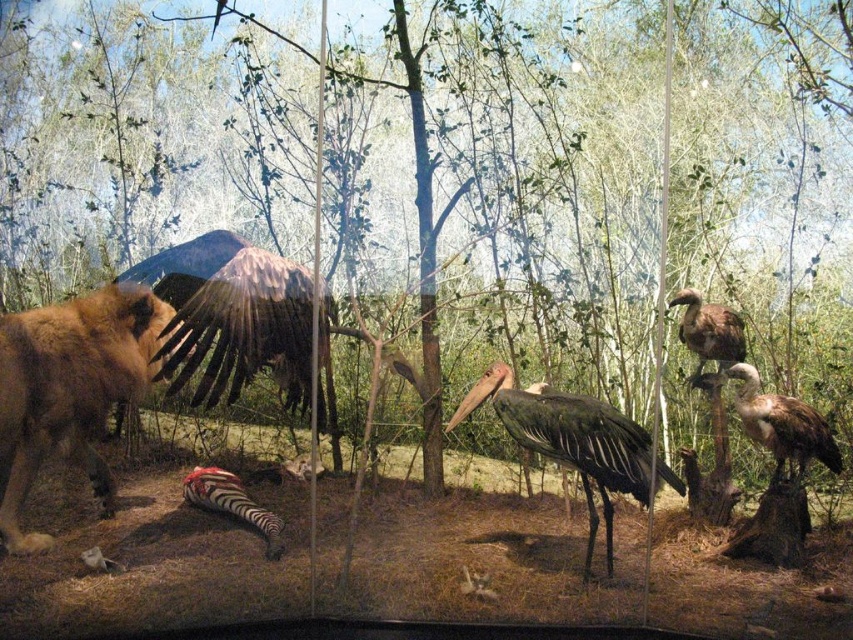
Question: Which point appears closest to the camera in this image?

Choices:
 (A) (672, 477)
 (B) (698, 310)

Answer: (A)

Question: Is brown feathered bird at left below brown feathered vulture at upper right?

Choices:
 (A) no
 (B) yes

Answer: (B)

Question: Which point is farther to the camera?

Choices:
 (A) tap(689, 346)
 (B) tap(90, 378)

Answer: (A)

Question: Can you confirm if dark gray matte stork at center is positioned to the left of zebra-patterned hide at center?

Choices:
 (A) no
 (B) yes

Answer: (A)

Question: Which of the following is the farthest from the observer?

Choices:
 (A) (546, 396)
 (B) (747, 387)
 (C) (708, 353)

Answer: (C)

Question: Does dark gray matte stork at center appear under brown feathered vulture at upper right?

Choices:
 (A) yes
 (B) no

Answer: (A)